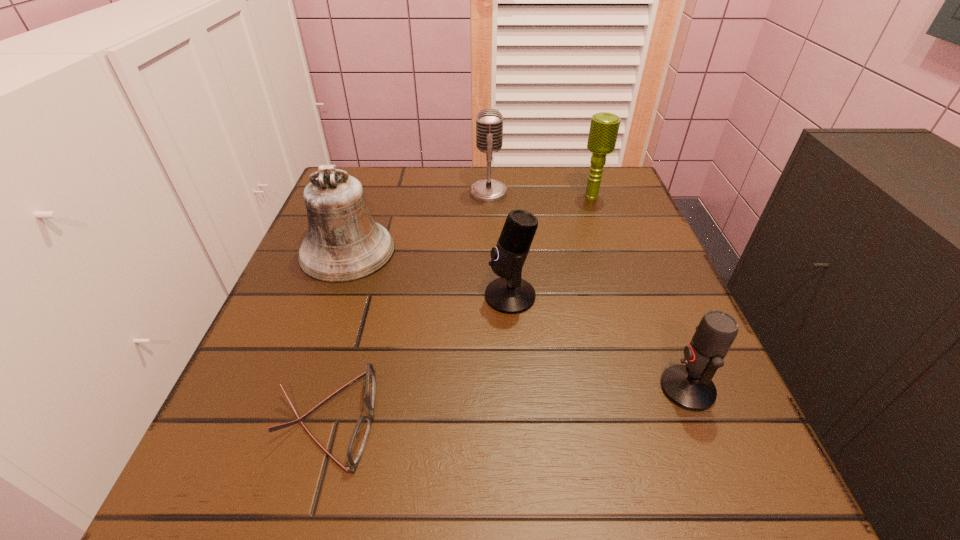
At what (x,y) coordinates should I click in order to perform the action: click on free space located on the side of the nearest microphone with the red ring. Please return your answer as a coordinate pair (x, y). This screenshot has height=540, width=960. Looking at the image, I should click on (564, 389).

Locate an element on the screen. The height and width of the screenshot is (540, 960). blank space located 0.290m on the side of the nearest microphone with the red ring is located at coordinates (473, 389).

Find the location of a particular element. vacant area situated on the front-facing side of the shortest object is located at coordinates coord(506,419).

Where is `object that is at the near edge`? object that is at the near edge is located at coordinates (358, 440).

Locate an element on the screen. This screenshot has width=960, height=540. bell that is at the left edge is located at coordinates (343, 244).

In order to click on spectacles at the left edge in this screenshot , I will do `click(358, 440)`.

This screenshot has height=540, width=960. What are the coordinates of `object that is at the near left corner` in the screenshot? It's located at (358, 440).

You are a GUI agent. You are given a task and a screenshot of the screen. Output one action in this format:
    pyautogui.click(x=<x>, y=<y>)
    Task: Click on the object that is at the far right corner
    
    Given the screenshot: What is the action you would take?
    pyautogui.click(x=604, y=127)

Where is `free region at the far edge`? free region at the far edge is located at coordinates (558, 215).

The width and height of the screenshot is (960, 540). Find the location of `vacant space at the left edge of the desktop`. vacant space at the left edge of the desktop is located at coordinates (347, 360).